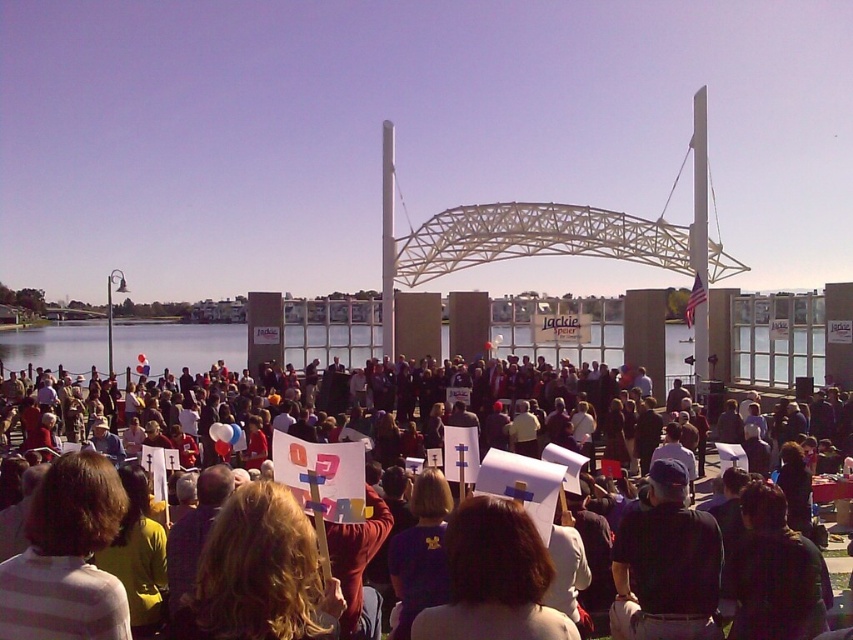
You are a photographer at the event and want to capture both the white paper signs at center and the dark blue fabric at center in your photo. Can you see both objects clearly in the same frame?

Yes, the white paper signs at center is in front of dark blue fabric at center, so both can be seen in the same frame as the signs are positioned in front but not blocking the entire view of the fabric.

You are a participant in the event and want to find the flagpole. You see the point marked at coordinates (685, 564) on the white paper signs at center. Based on this information, can you determine the direction to look for the flagpole relative to the signs?

The point (685, 564) is on white paper signs at center, so the flagpole is to the right of the signs.